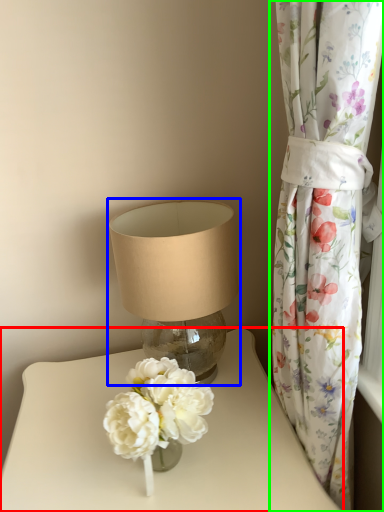
Question: Which is nearer to the table (highlighted by a red box)? lamp (highlighted by a blue box) or curtain (highlighted by a green box).

Choices:
 (A) lamp
 (B) curtain

Answer: (A)